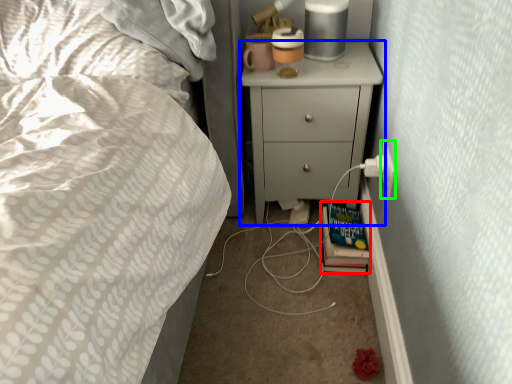
Question: Which object is the closest to the book (highlighted by a red box)? Choose among these: chest of drawers (highlighted by a blue box) or electric outlet (highlighted by a green box).

Choices:
 (A) chest of drawers
 (B) electric outlet

Answer: (B)